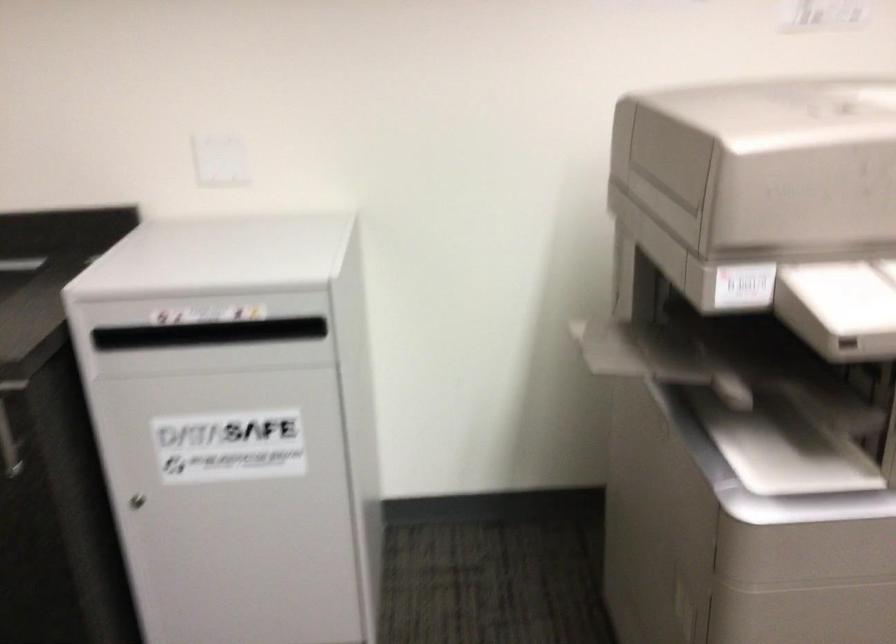
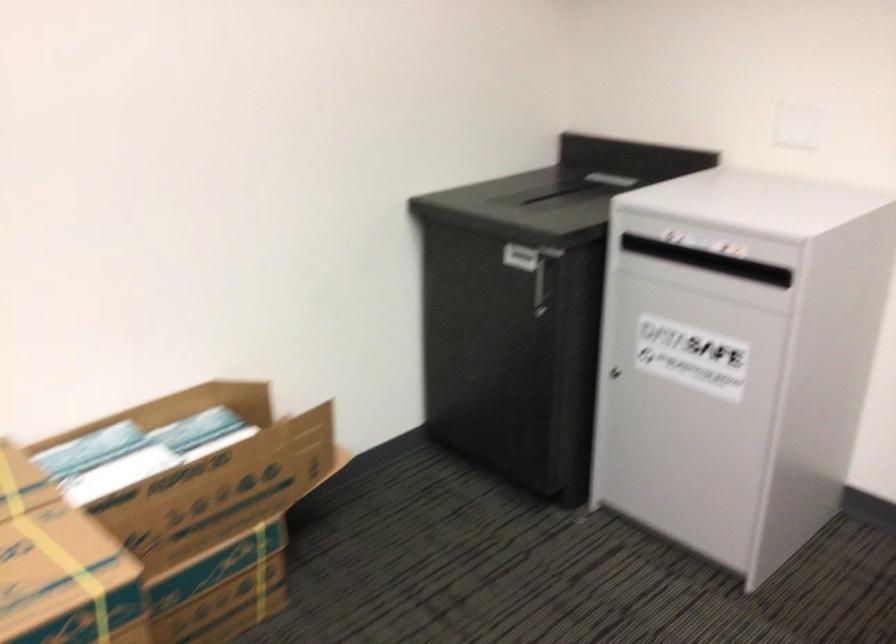
Locate, in the second image, the point that corresponds to the point at 221,325 in the first image.

(748, 269)